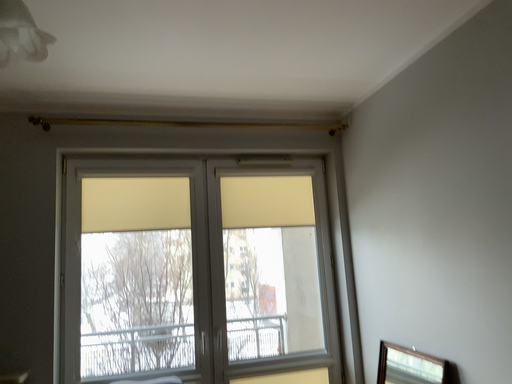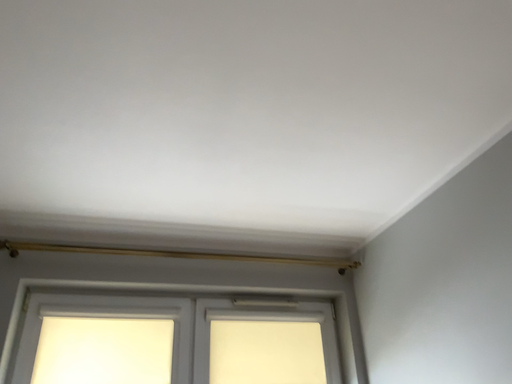
Question: Which way did the camera rotate in the video?

Choices:
 (A) rotated upward
 (B) rotated downward

Answer: (A)